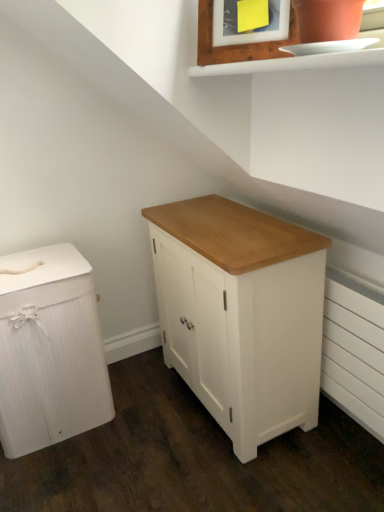
Find the location of a particular element. Image resolution: width=384 pixels, height=512 pixels. free space below wooden picture frame at upper center (from a real-world perspective) is located at coordinates (256, 240).